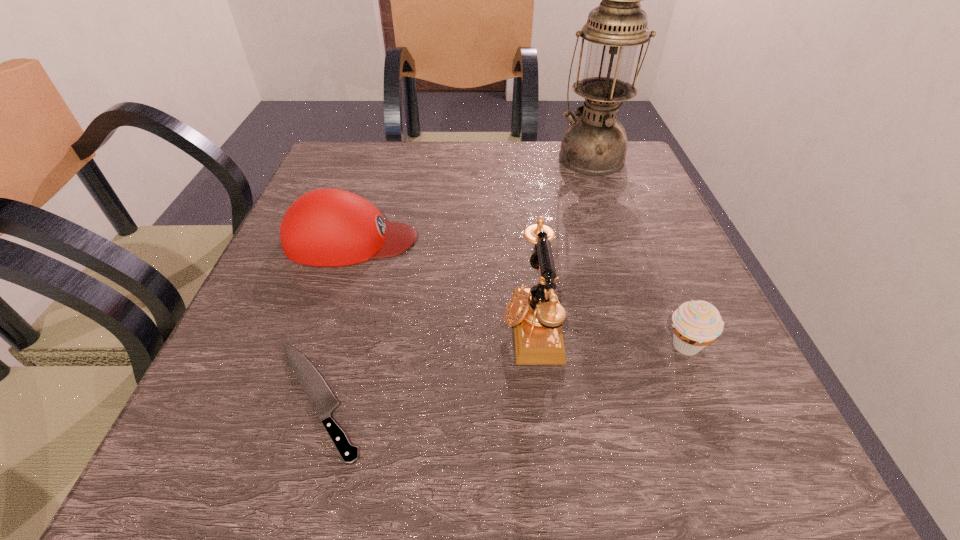
This screenshot has width=960, height=540. Find the location of `vacant point located between the third object from right to left and the shortest object`. vacant point located between the third object from right to left and the shortest object is located at coordinates (424, 362).

This screenshot has height=540, width=960. In order to click on free point between the muffin and the shortest object in this screenshot , I will do click(501, 372).

At what (x,y) coordinates should I click in order to perform the action: click on free space between the shortest object and the fourth shortest object. Please return your answer as a coordinate pair (x, y). The height and width of the screenshot is (540, 960). Looking at the image, I should click on (424, 362).

Where is `empty location between the second farthest object and the steak knife`? The width and height of the screenshot is (960, 540). empty location between the second farthest object and the steak knife is located at coordinates (334, 320).

Where is `unoccupied area between the muffin and the shortest object`? The image size is (960, 540). unoccupied area between the muffin and the shortest object is located at coordinates (501, 372).

What are the coordinates of `vacant space in between the muffin and the third object from left to right` in the screenshot? It's located at (609, 336).

The width and height of the screenshot is (960, 540). What are the coordinates of `free area in between the muffin and the farthest object` in the screenshot? It's located at (638, 252).

Select which object is the second closest to the muffin. Please provide its 2D coordinates. Your answer should be formatted as a tuple, i.e. [(x, y)], where the tuple contains the x and y coordinates of a point satisfying the conditions above.

[(327, 227)]

The image size is (960, 540). Find the location of `the fourth closest object to the fourth nearest object`. the fourth closest object to the fourth nearest object is located at coordinates (696, 324).

Locate an element on the screen. vacant area in the image that satisfies the following two spatial constraints: 1. on the front-facing side of the fourth nearest object; 2. on the right side of the muffin is located at coordinates (x=317, y=346).